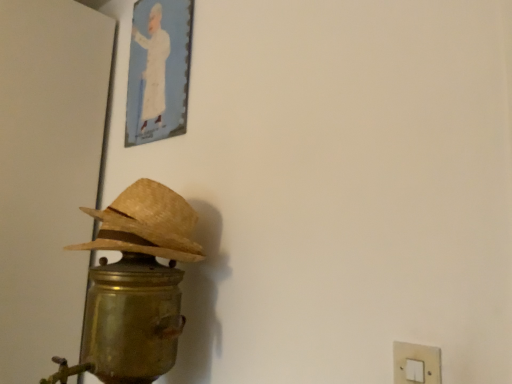
Find the location of a particular element. braided straw hat at left is located at coordinates (146, 224).

Measure the distance between point (115, 304) and camera.

The depth of point (115, 304) is 35.75 inches.

You are a GUI agent. You are given a task and a screenshot of the screen. Output one action in this format:
    pyautogui.click(x=<x>, y=<y>)
    Task: Click on the braided straw hat at left
    
    Given the screenshot: What is the action you would take?
    pyautogui.click(x=146, y=224)

Which is behind, point (415, 363) or point (102, 329)?

Positioned behind is point (102, 329).

Is white plastic light switch at lower right thinner than gold metallic table lamp at left?

Yes, white plastic light switch at lower right is thinner than gold metallic table lamp at left.

Image resolution: width=512 pixels, height=384 pixels. I want to click on table lamp behind the white plastic light switch at lower right, so click(x=137, y=284).

Considering the relative sizes of white plastic light switch at lower right and gold metallic table lamp at left in the image provided, is white plastic light switch at lower right smaller than gold metallic table lamp at left?

Yes.

In terms of height, does gold metallic table lamp at left look taller or shorter compared to white plastic light switch at lower right?

gold metallic table lamp at left is taller than white plastic light switch at lower right.

From the image's perspective, which is above, gold metallic table lamp at left or white plastic light switch at lower right?

white plastic light switch at lower right.

Is gold metallic table lamp at left in front of or behind white plastic light switch at lower right in the image?

gold metallic table lamp at left is positioned farther from the viewer than white plastic light switch at lower right.

Which is behind, point (162, 222) or point (399, 354)?

Positioned behind is point (162, 222).

Is white plastic light switch at lower right outside of braided straw hat at left?

Yes, white plastic light switch at lower right is outside of braided straw hat at left.

Considering the sizes of objects white plastic light switch at lower right and braided straw hat at left in the image provided, who is bigger, white plastic light switch at lower right or braided straw hat at left?

braided straw hat at left is bigger.

This screenshot has height=384, width=512. In order to click on hat that is above the white plastic light switch at lower right (from the image's perspective) in this screenshot , I will do `click(146, 224)`.

In the scene shown: From the image's perspective, which one is positioned lower, braided straw hat at left or gold metallic table lamp at left?

gold metallic table lamp at left.

Based on their positions, is braided straw hat at left located to the left or right of gold metallic table lamp at left?

From the image, it's evident that braided straw hat at left is to the right of gold metallic table lamp at left.

From a real-world perspective, is braided straw hat at left positioned above or below gold metallic table lamp at left?

braided straw hat at left is situated higher than gold metallic table lamp at left in the real world.

Is braided straw hat at left shorter than white plastic light switch at lower right?

No.

Is braided straw hat at left outside of white plastic light switch at lower right?

That's correct, braided straw hat at left is outside of white plastic light switch at lower right.

Is braided straw hat at left smaller than white plastic light switch at lower right?

No, braided straw hat at left is not smaller than white plastic light switch at lower right.

Does gold metallic table lamp at left have a lesser width compared to braided straw hat at left?

In fact, gold metallic table lamp at left might be wider than braided straw hat at left.

From a real-world perspective, which is physically below, gold metallic table lamp at left or braided straw hat at left?

gold metallic table lamp at left is physically lower.

How far apart are gold metallic table lamp at left and braided straw hat at left?

gold metallic table lamp at left and braided straw hat at left are 2.15 inches apart from each other.

Is gold metallic table lamp at left taller or shorter than braided straw hat at left?

Considering their sizes, gold metallic table lamp at left has more height than braided straw hat at left.

Locate an element on the screen. The height and width of the screenshot is (384, 512). light switch in front of the gold metallic table lamp at left is located at coordinates (416, 363).

I want to click on table lamp that appears behind the white plastic light switch at lower right, so click(137, 284).

When comparing their distances from braided straw hat at left, does white plastic light switch at lower right or gold metallic table lamp at left seem further?

white plastic light switch at lower right is further to braided straw hat at left.

When comparing their distances from braided straw hat at left, does gold metallic table lamp at left or white plastic light switch at lower right seem closer?

Based on the image, gold metallic table lamp at left appears to be nearer to braided straw hat at left.

Based on their spatial positions, is braided straw hat at left or white plastic light switch at lower right closer to gold metallic table lamp at left?

braided straw hat at left lies closer to gold metallic table lamp at left than the other object.

Considering their positions, is white plastic light switch at lower right positioned further to gold metallic table lamp at left than braided straw hat at left?

white plastic light switch at lower right is further to gold metallic table lamp at left.

From the image, which object appears to be nearer to white plastic light switch at lower right, braided straw hat at left or gold metallic table lamp at left?

gold metallic table lamp at left is closer to white plastic light switch at lower right.

From the image, which object appears to be nearer to white plastic light switch at lower right, gold metallic table lamp at left or braided straw hat at left?

gold metallic table lamp at left.

Find the location of `hat located between gold metallic table lamp at left and white plastic light switch at lower right in the left-right direction`. hat located between gold metallic table lamp at left and white plastic light switch at lower right in the left-right direction is located at coordinates (146, 224).